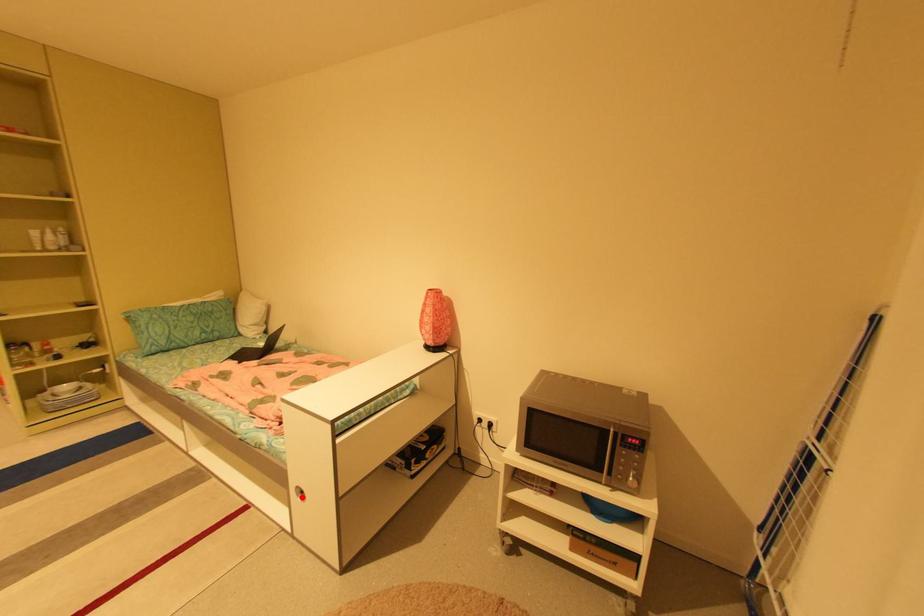
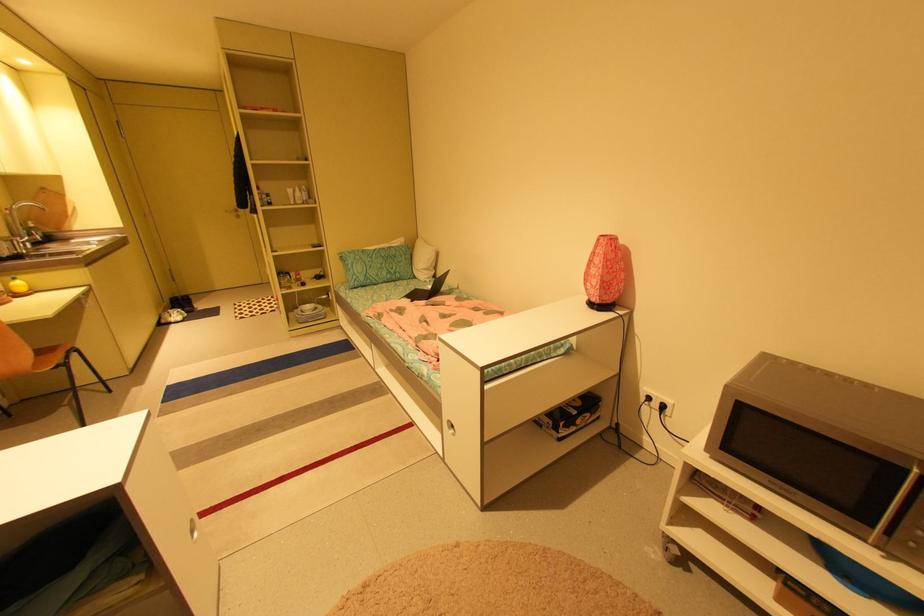
The point at the highlighted location is marked in the first image. Where is the corresponding point in the second image?

(454, 429)